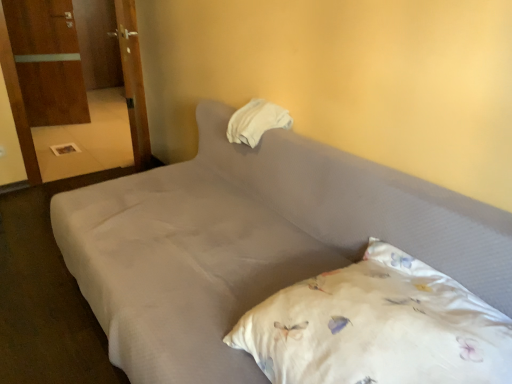
Question: In terms of width, does gray fabric bed at center look wider or thinner when compared to wooden armoire at left, placed as the 1th armoire when sorted from back to front?

Choices:
 (A) thin
 (B) wide

Answer: (B)

Question: From a real-world perspective, is gray fabric bed at center physically located above or below wooden armoire at left, the second armoire positioned from the front?

Choices:
 (A) below
 (B) above

Answer: (A)

Question: Which object is the farthest from the white floral pillow at lower right, the second pillow in the top-to-bottom sequence?

Choices:
 (A) wooden door at upper left
 (B) wooden door at left, the second armoire viewed from the back
 (C) wooden armoire at left, placed as the 1th armoire when sorted from back to front
 (D) gray fabric bed at center
 (E) white fabric pillow at upper center, acting as the 1th pillow starting from the back

Answer: (C)

Question: Which of these objects is positioned farthest from the white fabric pillow at upper center, the second pillow from the front?

Choices:
 (A) wooden armoire at left, the second armoire positioned from the front
 (B) gray fabric bed at center
 (C) white floral pillow at lower right, acting as the 1th pillow starting from the bottom
 (D) wooden door at left, the 2th armoire when ordered from left to right
 (E) wooden door at upper left

Answer: (A)